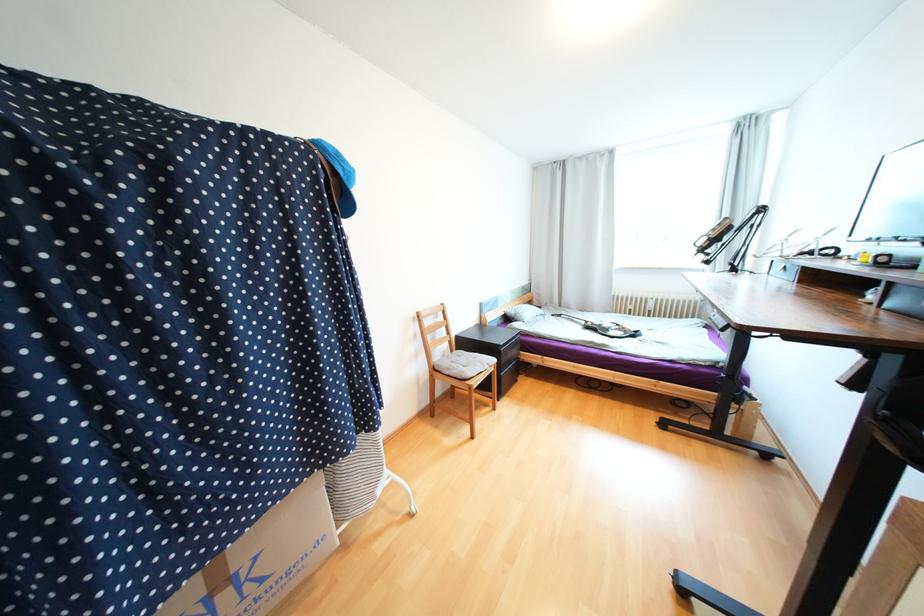
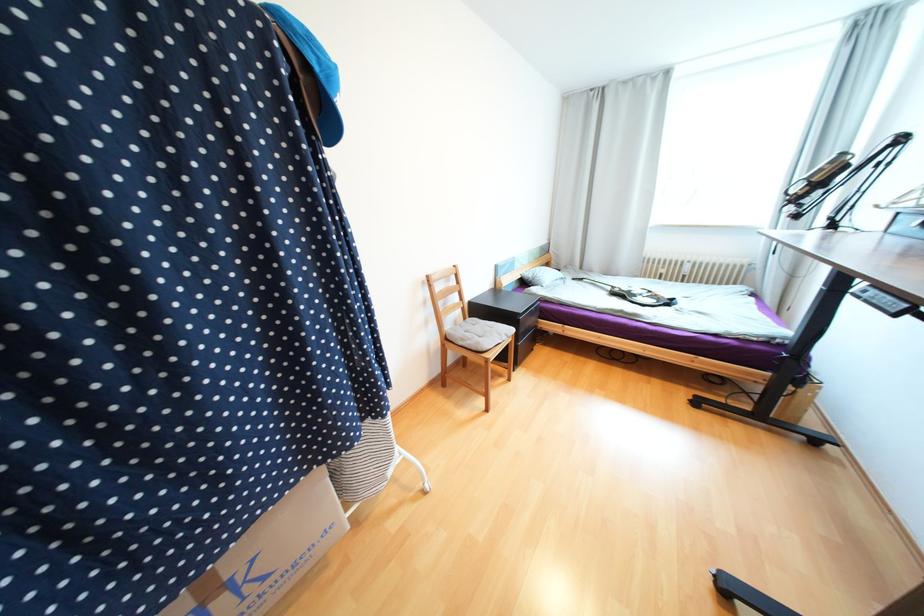
Question: The images are taken continuously from a first-person perspective. In which direction is your viewpoint rotating?

Choices:
 (A) Left
 (B) Right
 (C) Up
 (D) Down

Answer: (D)